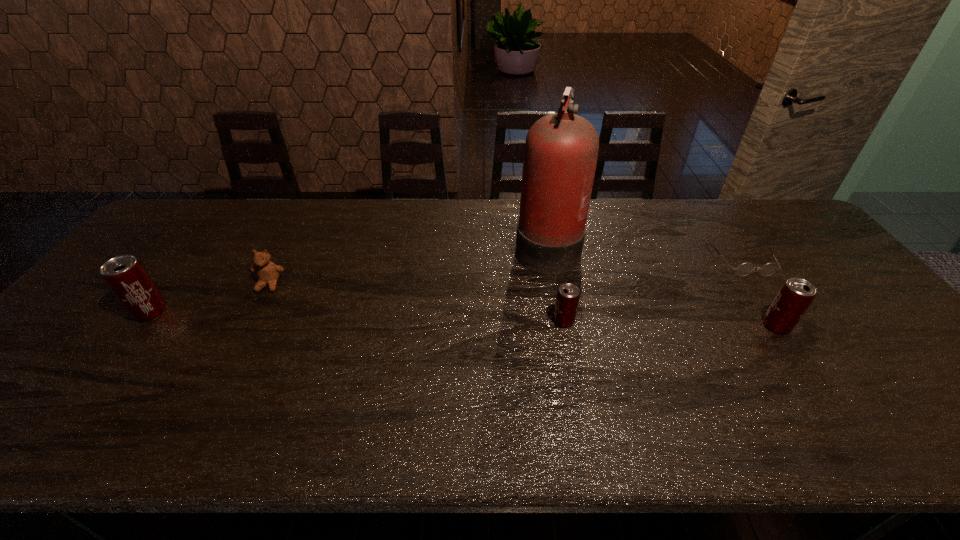
The height and width of the screenshot is (540, 960). I want to click on vacant region that satisfies the following two spatial constraints: 1. at the nozzle of the second beer can from left to right; 2. on the left side of the tallest object, so click(x=561, y=321).

In order to click on vacant space that satisfies the following two spatial constraints: 1. at the nozzle of the rightmost beer can; 2. on the left side of the tallest object in this screenshot , I will do `click(561, 326)`.